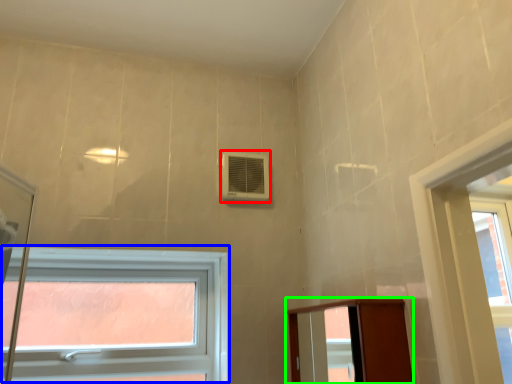
Question: Which object is the farthest from air conditioning (highlighted by a red box)? Choose among these: window (highlighted by a blue box) or elevator (highlighted by a green box).

Choices:
 (A) window
 (B) elevator

Answer: (B)